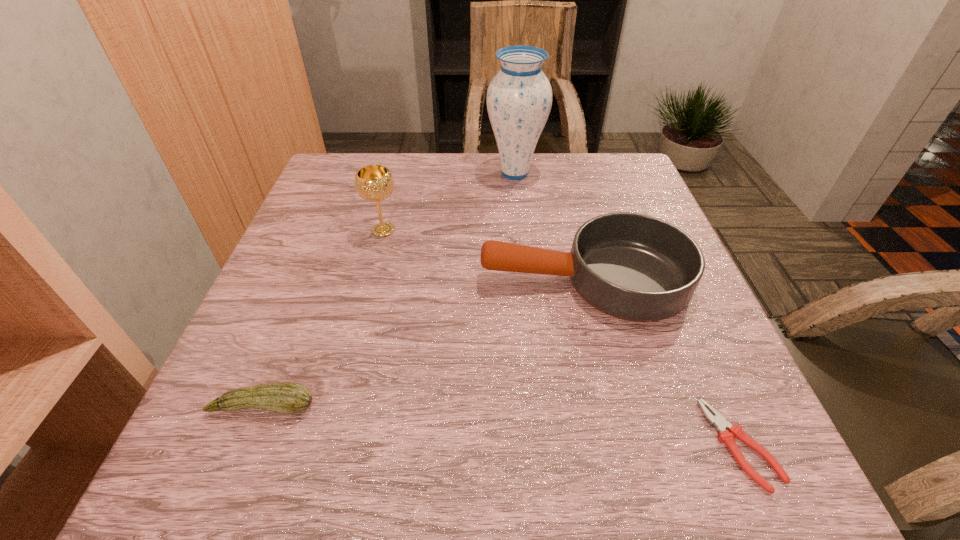
At what (x,y) coordinates should I click in order to perform the action: click on free region at the left edge of the desktop. Please return your answer as a coordinate pair (x, y). This screenshot has height=540, width=960. Looking at the image, I should click on 315,245.

The width and height of the screenshot is (960, 540). What are the coordinates of `free space at the right edge` in the screenshot? It's located at (602, 202).

In the image, there is a desktop. Identify the location of vacant space at the far left corner. This screenshot has height=540, width=960. (329, 198).

This screenshot has width=960, height=540. What are the coordinates of `vacant space at the far right corner of the desktop` in the screenshot? It's located at (612, 192).

You are a GUI agent. You are given a task and a screenshot of the screen. Output one action in this format:
    pyautogui.click(x=<x>, y=<y>)
    Task: Click on the blank space at the near right corner
    
    Given the screenshot: What is the action you would take?
    pyautogui.click(x=774, y=480)

Where is `free space between the fourth tallest object and the pan`? free space between the fourth tallest object and the pan is located at coordinates coord(423,342).

Locate an element on the screen. free point between the fourth tallest object and the farthest object is located at coordinates (389, 289).

You are a GUI agent. You are given a task and a screenshot of the screen. Output one action in this format:
    pyautogui.click(x=<x>, y=<y>)
    Task: Click on the free spot between the zucchini and the third tallest object
    The height and width of the screenshot is (540, 960).
    Given the screenshot: What is the action you would take?
    pyautogui.click(x=423, y=342)

You are a GUI agent. You are given a task and a screenshot of the screen. Output one action in this format:
    pyautogui.click(x=<x>, y=<y>)
    Task: Click on the vacant region between the pan and the fourth tallest object
    The width and height of the screenshot is (960, 540).
    Given the screenshot: What is the action you would take?
    pyautogui.click(x=423, y=342)

Locate an element on the screen. vacant area between the second tallest object and the tallest object is located at coordinates (449, 201).